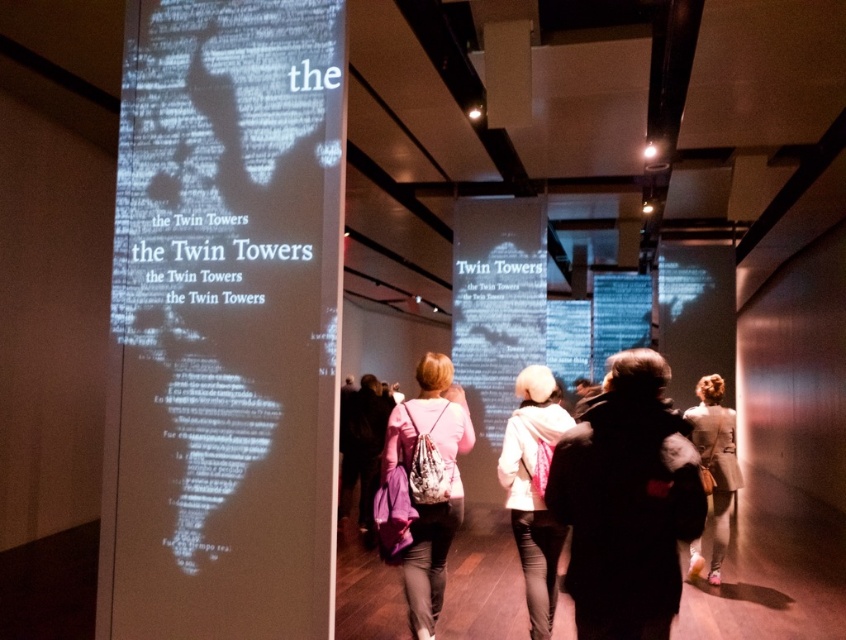
You are a GUI agent. You are given a task and a screenshot of the screen. Output one action in this format:
    pyautogui.click(x=<x>, y=<y>)
    Task: Click on the pink fabric bag at center
    The image size is (846, 640).
    Given the screenshot: What is the action you would take?
    pyautogui.click(x=423, y=486)

Is the position of pink fabric bag at center more distant than that of light beige coat at lower right?

No, pink fabric bag at center is in front of light beige coat at lower right.

Image resolution: width=846 pixels, height=640 pixels. Describe the element at coordinates (423, 486) in the screenshot. I see `pink fabric bag at center` at that location.

Locate an element on the screen. pink fabric bag at center is located at coordinates (423, 486).

I want to click on pink fabric bag at center, so click(423, 486).

Between point (423, 564) and point (522, 480), which one is positioned in front?

Point (423, 564)

The height and width of the screenshot is (640, 846). Identify the location of pink fabric bag at center. (423, 486).

Which is above, white fleece jacket at center or light beige coat at lower right?

Positioned higher is white fleece jacket at center.

Is point (540, 374) positioned behind point (733, 410)?

No.

Describe the element at coordinates (533, 490) in the screenshot. This screenshot has width=846, height=640. I see `white fleece jacket at center` at that location.

Where is `white fleece jacket at center`? The height and width of the screenshot is (640, 846). white fleece jacket at center is located at coordinates (533, 490).